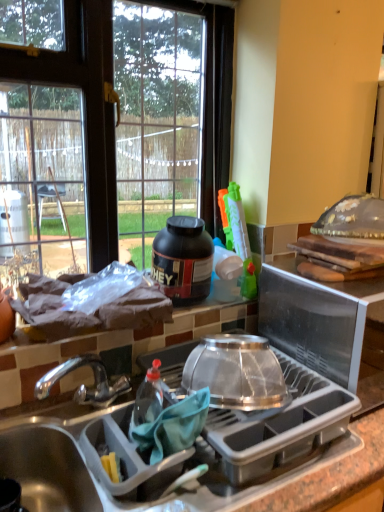
Question: Is matte gray sink at lower left at the right side of transparent glass window at upper left?

Choices:
 (A) yes
 (B) no

Answer: (A)

Question: Is matte gray sink at lower left surrounding transparent glass window at upper left?

Choices:
 (A) no
 (B) yes

Answer: (A)

Question: Is matte gray sink at lower left facing away from transparent glass window at upper left?

Choices:
 (A) yes
 (B) no

Answer: (B)

Question: Is matte gray sink at lower left bigger than transparent glass window at upper left?

Choices:
 (A) no
 (B) yes

Answer: (A)

Question: Considering the relative positions of matte gray sink at lower left and transparent glass window at upper left in the image provided, is matte gray sink at lower left in front of transparent glass window at upper left?

Choices:
 (A) yes
 (B) no

Answer: (A)

Question: Would you say matte gray sink at lower left is a long distance from transparent glass window at upper left?

Choices:
 (A) yes
 (B) no

Answer: (A)

Question: Are black matte protein jar at upper center, placed as the 2th kitchen appliance when sorted from bottom to top, and transparent plastic lid at upper right, the 1th appliance when ordered from right to left, located far from each other?

Choices:
 (A) no
 (B) yes

Answer: (A)

Question: Is black matte protein jar at upper center, the 2th kitchen appliance viewed from the front, in contact with transparent plastic lid at upper right, the 2th appliance from the left?

Choices:
 (A) yes
 (B) no

Answer: (B)

Question: Is black matte protein jar at upper center, the first kitchen appliance when ordered from top to bottom, to the left of transparent plastic lid at upper right, the 1th appliance when ordered from right to left, from the viewer's perspective?

Choices:
 (A) no
 (B) yes

Answer: (B)

Question: From a real-world perspective, is black matte protein jar at upper center, placed as the 2th kitchen appliance when sorted from bottom to top, positioned over transparent plastic lid at upper right, the 2th appliance from the left, based on gravity?

Choices:
 (A) yes
 (B) no

Answer: (A)

Question: Is black matte protein jar at upper center, the first kitchen appliance when ordered from top to bottom, taller than transparent plastic lid at upper right, the 1th appliance when ordered from right to left?

Choices:
 (A) yes
 (B) no

Answer: (B)

Question: Does black matte protein jar at upper center, the first kitchen appliance when ordered from top to bottom, have a larger size compared to transparent plastic lid at upper right, the 1th appliance when ordered from right to left?

Choices:
 (A) no
 (B) yes

Answer: (A)

Question: Is matte gray sink at lower left thinner than gray plastic dish rack at center?

Choices:
 (A) no
 (B) yes

Answer: (B)